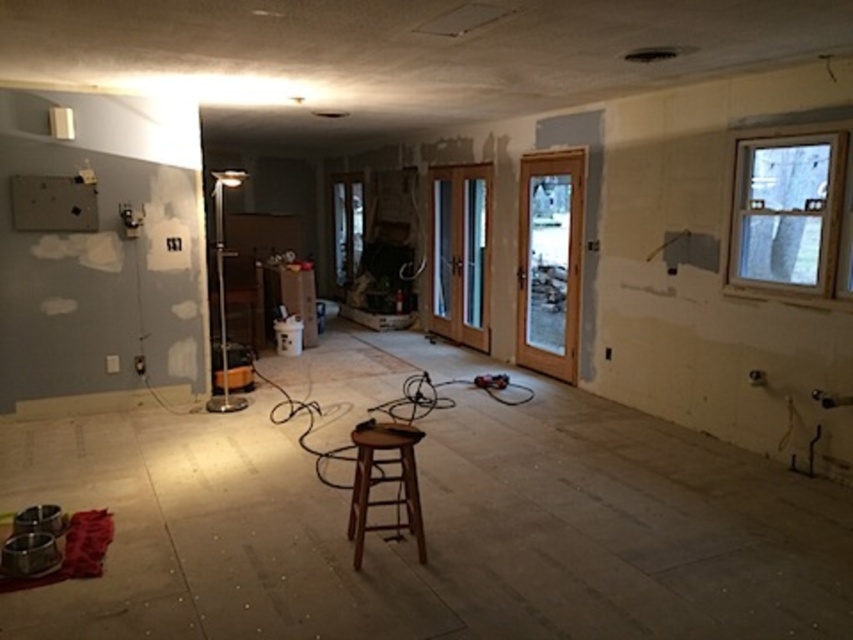
You are a contractor standing at the clear glass window at upper right and need to reach the camera. Given that the room is 13 feet long from the window to the far wall, can you walk straight to the camera without needing to go around any obstacles?

The clear glass window at upper right and camera are 13.03 feet apart. Since the room is 13 feet long from the window to the far wall, the distance is almost exactly the length of the room. Therefore, you can walk straight to the camera without needing to go around obstacles, as the distance matches the room length closely.

You are a construction worker who needs to move a 10 feet long ladder from the clear glass window at upper right to the brown wooden stool at center. Can you move the ladder horizontally without tilting it? Please explain your answer based on the distance between them.

The clear glass window at upper right and brown wooden stool at center are 9.72 feet apart. Since the ladder is 10 feet long, it is slightly longer than the distance between them. Therefore, you cannot move the ladder horizontally without tilting it because the distance is shorter than the ladder length.